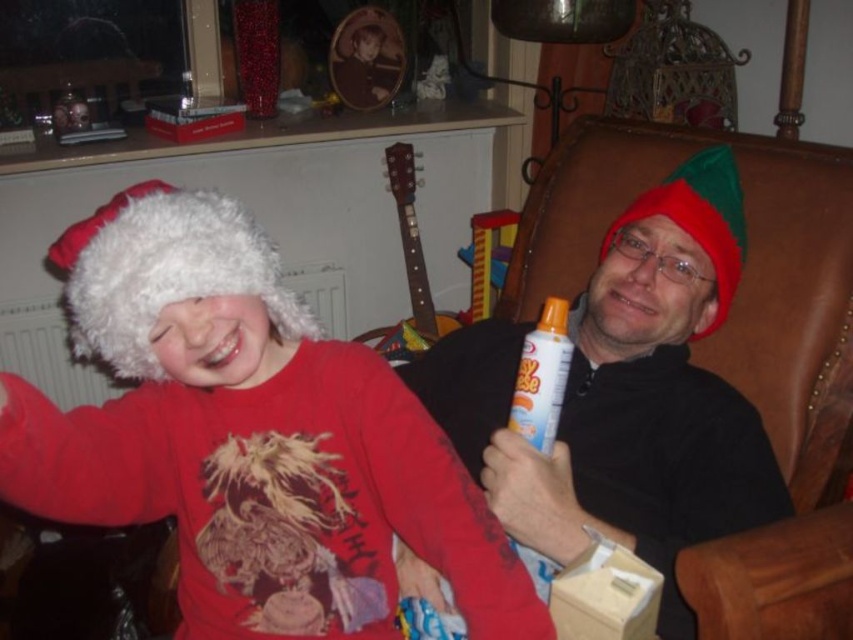
You are standing in the cozy indoor scene with two people on the brown leather armchair. You notice two points marked in the image. The first point is at coordinates point (256,296) and the second is at point (694,458). From your perspective, which point is closer to you?

Point (256,296) is in front of point (694,458), so it is closer to you.

You are a photographer trying to capture a holiday photo of the two people sitting on the brown leather armchair. You notice both the fuzzy white hat at left and the fuzzy white hat at right in your frame. Which fuzzy white hat is positioned to the left in the image?

The fuzzy white hat at left is positioned to the left of the fuzzy white hat at right in the image.